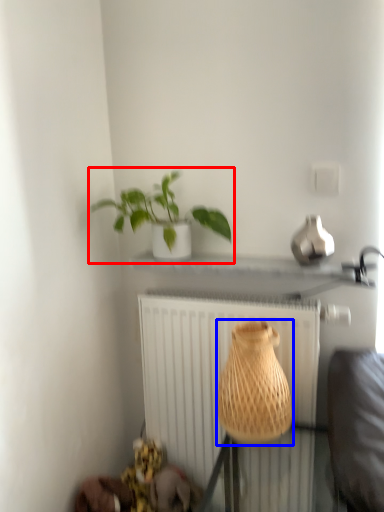
Question: Which object appears farthest to the camera in this image, houseplant (highlighted by a red box) or vase (highlighted by a blue box)?

Choices:
 (A) houseplant
 (B) vase

Answer: (A)